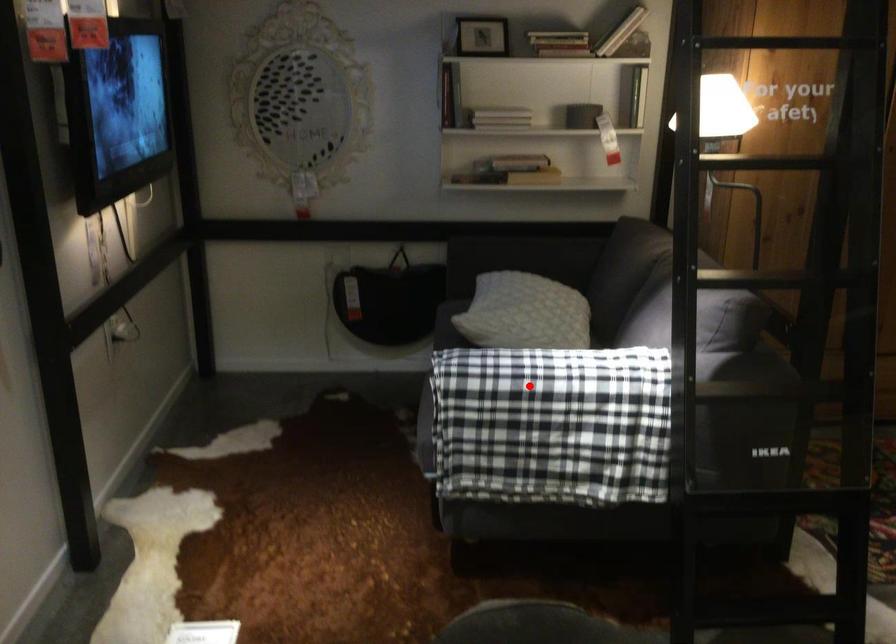
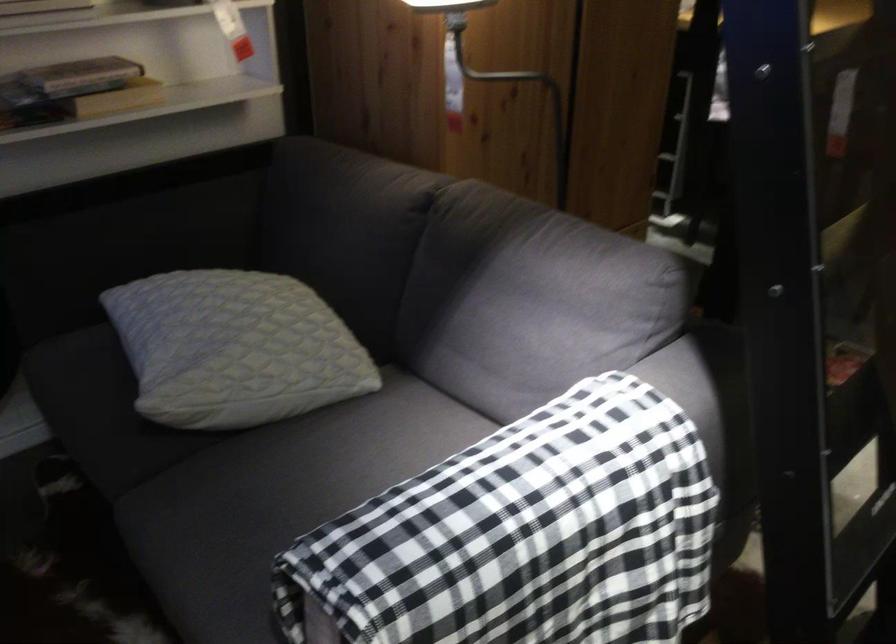
Question: I am providing you with two images of the same scene from different viewpoints. Given a red point in image1, look at the same physical point in image2. Is it:

Choices:
 (A) Closer to the viewpoint
 (B) Farther from the viewpoint

Answer: (A)